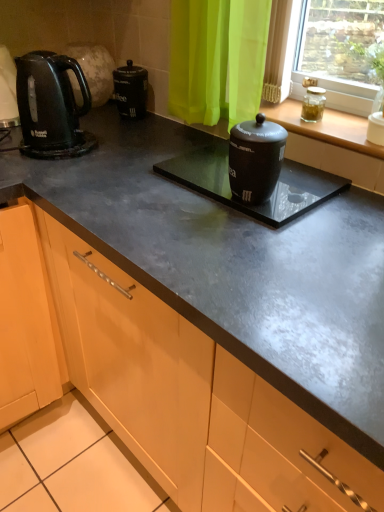
Where is `free space behind matte black kettle at left`? The width and height of the screenshot is (384, 512). free space behind matte black kettle at left is located at coordinates 107,124.